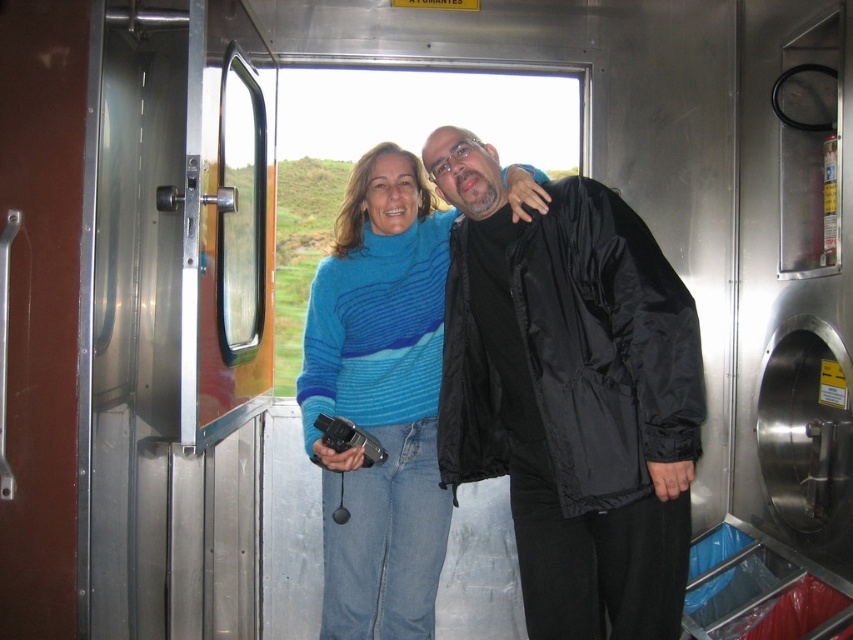
You are designing a storage compartment in the train car to hold both the matte black jacket at center and the blue striped sweater at center. Which item requires more space due to its size?

The matte black jacket at center requires more space because it is larger in size than the blue striped sweater at center.

You are an observer inside the train car. You notice two people wearing different clothing items at the center. Which clothing item, the matte black jacket at center or the blue striped sweater at center, reaches a lower point on the body?

The matte black jacket at center is shorter than the blue striped sweater at center, so the matte black jacket at center reaches a lower point on the body.

You are a photographer inside the train car and need to take a photo of the matte black jacket at center and the blue striped sweater at center. Which one is positioned to the right side of the other?

The matte black jacket at center is to the right of the blue striped sweater at center.